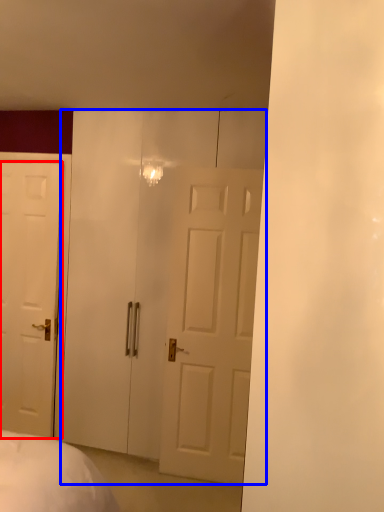
Question: Which point is further to the camera, door (highlighted by a red box) or glass door (highlighted by a blue box)?

Choices:
 (A) door
 (B) glass door

Answer: (A)